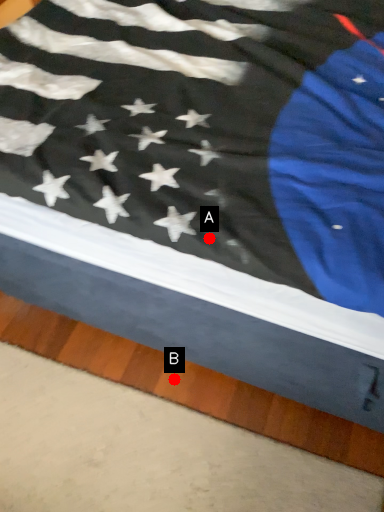
Question: Two points are circled on the image, labeled by A and B beside each circle. Which point is further to the camera?

Choices:
 (A) A is further
 (B) B is further

Answer: (B)